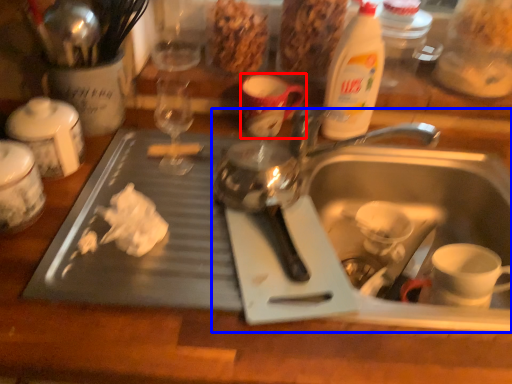
Question: Among these objects, which one is farthest to the camera, mug (highlighted by a red box) or sink (highlighted by a blue box)?

Choices:
 (A) mug
 (B) sink

Answer: (A)